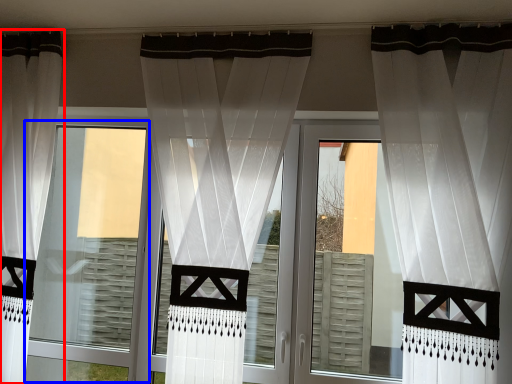
Question: Among these objects, which one is nearest to the camera, curtain (highlighted by a red box) or window frame (highlighted by a blue box)?

Choices:
 (A) curtain
 (B) window frame

Answer: (A)